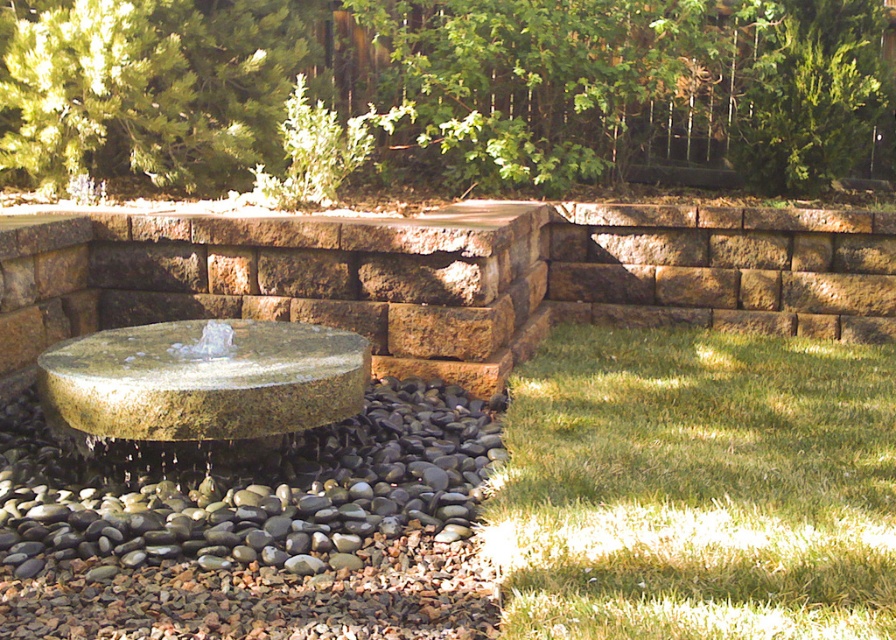
Question: Which object is the closest to the green grass at lower right?

Choices:
 (A) greenish-gray stone fountain at center
 (B) green stone wall at center

Answer: (A)

Question: Is green grass at lower right positioned at the back of green stone fountain at center?

Choices:
 (A) no
 (B) yes

Answer: (A)

Question: Does green stone wall at center have a greater width compared to green grass at lower right?

Choices:
 (A) no
 (B) yes

Answer: (B)

Question: Is green grass at lower right thinner than greenish-gray stone fountain at center?

Choices:
 (A) no
 (B) yes

Answer: (A)

Question: Which object is positioned farthest from the green grass at lower right?

Choices:
 (A) greenish-gray stone fountain at center
 (B) green stone wall at center
 (C) green stone fountain at center

Answer: (B)

Question: Which point is farther to the camera?

Choices:
 (A) (800, 189)
 (B) (332, 340)
 (C) (203, 525)

Answer: (A)